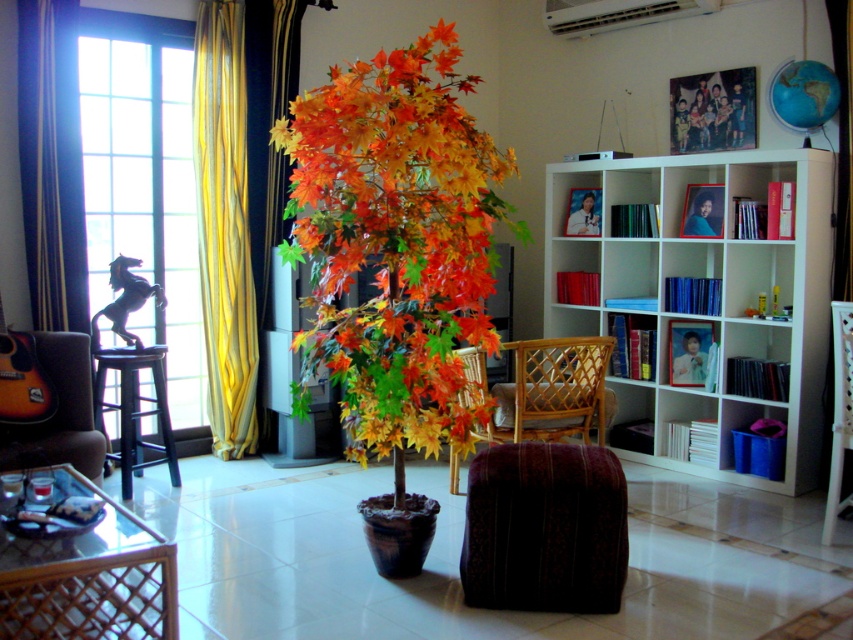
Is point (660, 337) closer to camera compared to point (77, 150)?

No, (660, 337) is further to viewer.

Can you confirm if white wooden bookcase at right is smaller than yellow/golden fabric curtain at left?

Incorrect, white wooden bookcase at right is not smaller in size than yellow/golden fabric curtain at left.

The width and height of the screenshot is (853, 640). What do you see at coordinates (718, 292) in the screenshot?
I see `white wooden bookcase at right` at bounding box center [718, 292].

Where is `white wooden bookcase at right`? This screenshot has height=640, width=853. white wooden bookcase at right is located at coordinates (718, 292).

Can you confirm if yellow/golden fabric curtain at left is bigger than woven wood armchair at lower left?

Actually, yellow/golden fabric curtain at left might be smaller than woven wood armchair at lower left.

Does yellow/golden fabric curtain at left appear on the right side of woven wood armchair at lower left?

Incorrect, yellow/golden fabric curtain at left is not on the right side of woven wood armchair at lower left.

Identify the location of yellow/golden fabric curtain at left. (51, 163).

Consider the image. Can you confirm if white wooden bookcase at right is positioned below brown leather armchair at left?

No.

Does white wooden bookcase at right lie in front of brown leather armchair at left?

No.

Which is behind, point (717, 272) or point (61, 346)?

The point (717, 272) is more distant.

The height and width of the screenshot is (640, 853). What are the coordinates of `white wooden bookcase at right` in the screenshot? It's located at (718, 292).